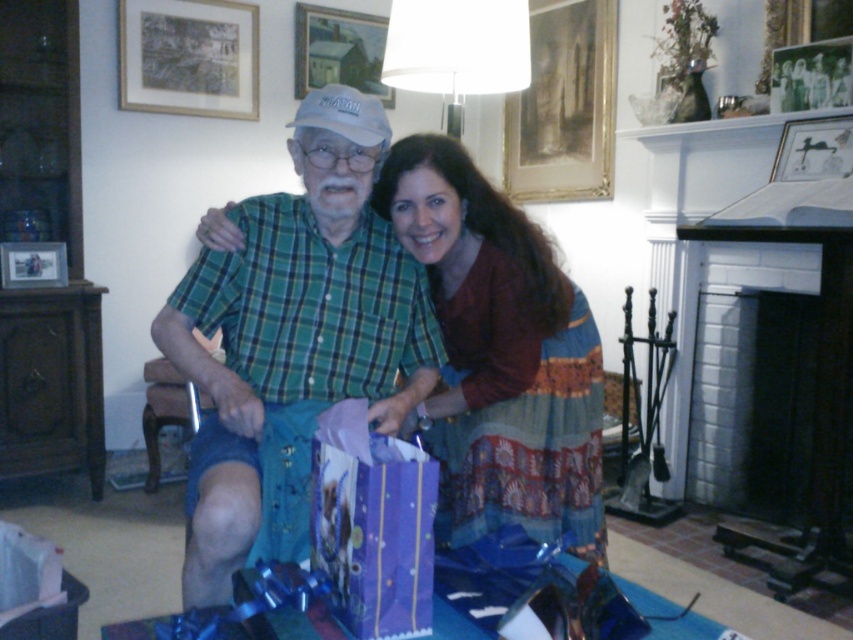
Image resolution: width=853 pixels, height=640 pixels. I want to click on matte black picture frame at upper right, so click(x=814, y=148).

This screenshot has height=640, width=853. What are the coordinates of `matte black picture frame at upper right` in the screenshot? It's located at (814, 148).

In the scene shown: Which is below, maroon fabric dress at center or matte wooden picture frame at upper center?

Positioned lower is maroon fabric dress at center.

Does maroon fabric dress at center appear on the left side of matte wooden picture frame at upper center?

In fact, maroon fabric dress at center is to the right of matte wooden picture frame at upper center.

Does point (473, 385) lie in front of point (383, 24)?

That is True.

You are a GUI agent. You are given a task and a screenshot of the screen. Output one action in this format:
    pyautogui.click(x=<x>, y=<y>)
    Task: Click on the maroon fabric dress at center
    The image size is (853, 640).
    Given the screenshot: What is the action you would take?
    pyautogui.click(x=500, y=355)

How much distance is there between green plaid shirt at center and gold-framed painting at upper center?

The distance of green plaid shirt at center from gold-framed painting at upper center is 2.30 meters.

Is green plaid shirt at center to the left of gold-framed painting at upper center from the viewer's perspective?

Correct, you'll find green plaid shirt at center to the left of gold-framed painting at upper center.

At what (x,y) coordinates should I click in order to perform the action: click on green plaid shirt at center. Please return your answer as a coordinate pair (x, y). Image resolution: width=853 pixels, height=640 pixels. Looking at the image, I should click on click(293, 340).